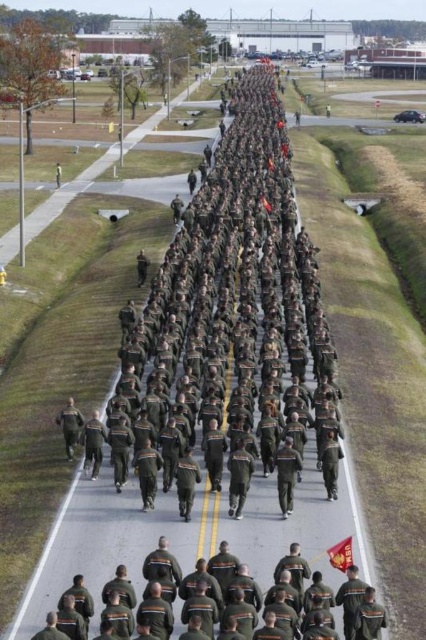
In the scene shown: You are a photographer positioned at the side of the road capturing the military march. You notice the dark green uniform at lower right and the red fabric flag at center. Which object should you zoom in on to get a clearer image of the details, and why?

You should zoom in on the dark green uniform at lower right because it is larger in size than the red fabric flag at center, making it easier to capture detailed features without needing excessive magnification.

You are a drone operator observing the military formation. You notice two points marked on your screen at coordinates point (204,573) and point (331,557). Based on the scene, which point is closer to the front of the formation?

Point (204,573) is in front of point (331,557), so it is closer to the front of the formation.